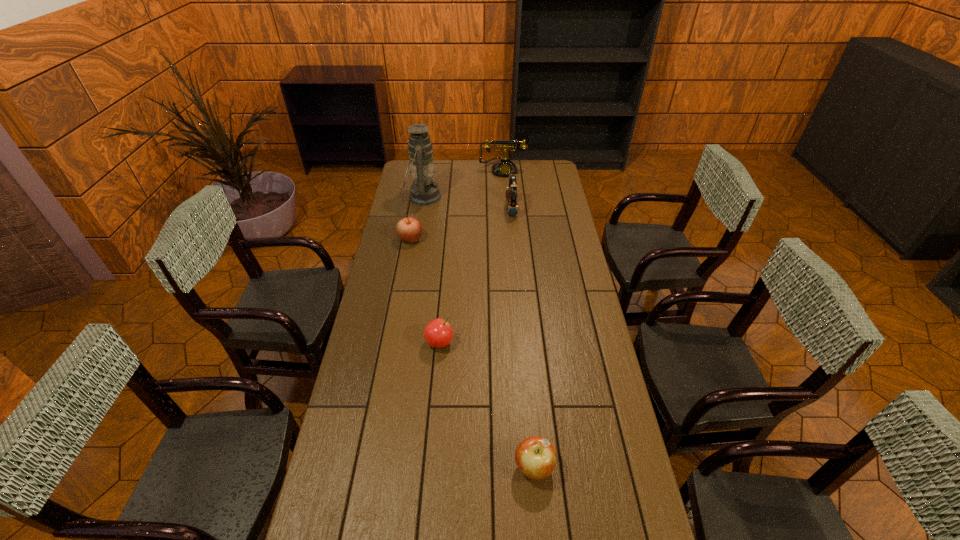
The height and width of the screenshot is (540, 960). What are the coordinates of `the tallest object` in the screenshot? It's located at (424, 191).

The width and height of the screenshot is (960, 540). Identify the location of the farthest object. (504, 167).

Where is `headset`? This screenshot has height=540, width=960. headset is located at coordinates (512, 208).

Identify the location of the farthest apple. (409, 229).

Where is `the leftmost apple`? This screenshot has width=960, height=540. the leftmost apple is located at coordinates (409, 229).

Locate an element on the screen. Image resolution: width=960 pixels, height=540 pixels. the nearest object is located at coordinates (535, 456).

Where is `the rightmost apple`? the rightmost apple is located at coordinates (535, 456).

You are a GUI agent. You are given a task and a screenshot of the screen. Output one action in this format:
    pyautogui.click(x=<x>, y=<y>)
    Task: Click on the second farthest apple
    
    Given the screenshot: What is the action you would take?
    pyautogui.click(x=438, y=333)

You are a GUI agent. You are given a task and a screenshot of the screen. Output one action in this format:
    pyautogui.click(x=<x>, y=<y>)
    Task: Click on the fifth farthest object
    This screenshot has height=540, width=960.
    Given the screenshot: What is the action you would take?
    pyautogui.click(x=438, y=333)

Find the location of a particular element. This screenshot has height=540, width=960. vacant space located 0.050m on the front of the oil lamp is located at coordinates (420, 217).